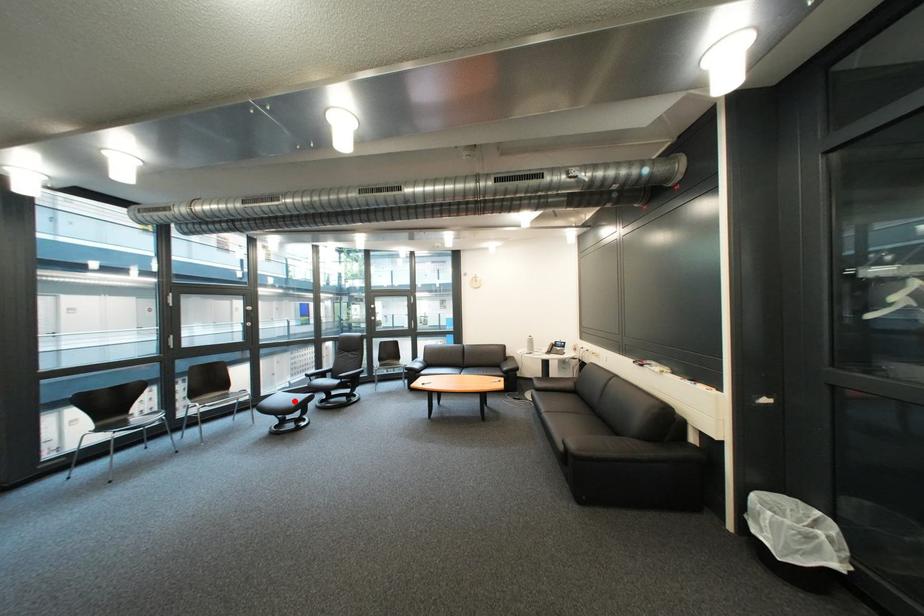
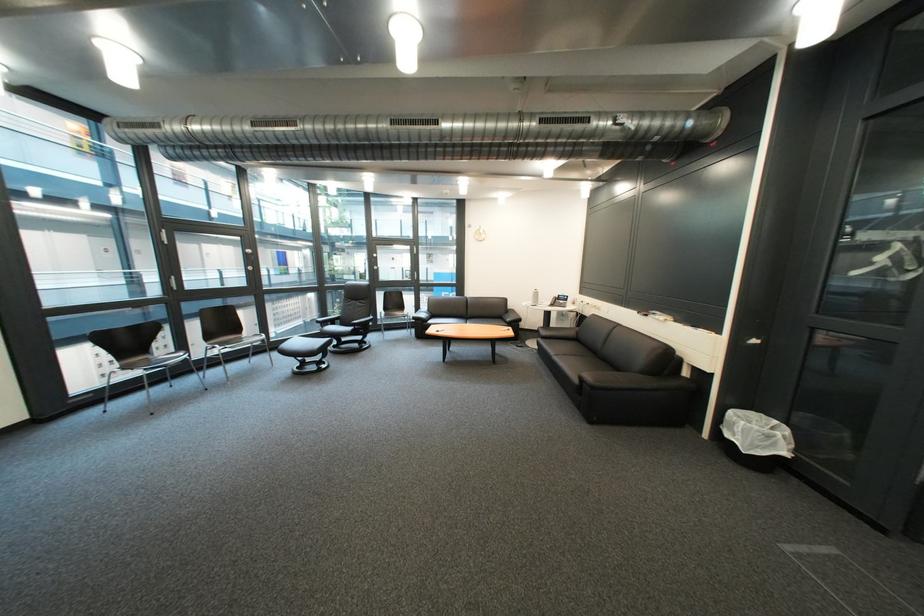
Question: I am providing you with two images of the same scene from different viewpoints. Given a red point in image1, look at the same physical point in image2. Is it:

Choices:
 (A) Closer to the viewpoint
 (B) Farther from the viewpoint

Answer: (A)